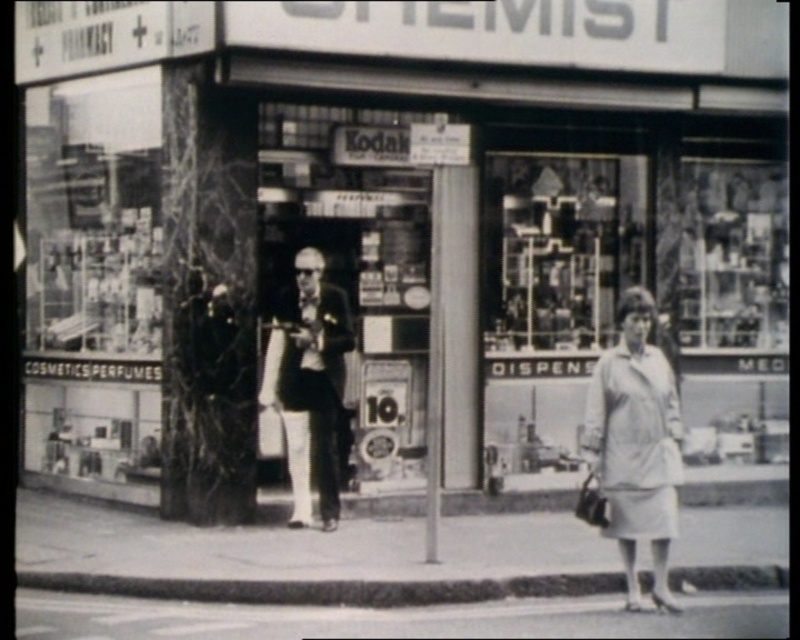
Question: Does metallic glass shelves at center appear on the right side of light gray fabric coat at center?

Choices:
 (A) yes
 (B) no

Answer: (B)

Question: From the image, what is the correct spatial relationship of light gray fabric coat at center in relation to smooth black suit at center?

Choices:
 (A) above
 (B) below

Answer: (B)

Question: Which of these objects is positioned closest to the light gray fabric coat at center?

Choices:
 (A) smooth black suit at center
 (B) metallic glass shelves at center

Answer: (A)

Question: Which point is closer to the camera?

Choices:
 (A) (586, 189)
 (B) (332, 474)

Answer: (B)

Question: Which of the following is the farthest from the observer?

Choices:
 (A) (500, 332)
 (B) (630, 442)
 (C) (304, 522)

Answer: (A)

Question: Can you confirm if metallic glass shelves at center is wider than smooth black suit at center?

Choices:
 (A) yes
 (B) no

Answer: (A)